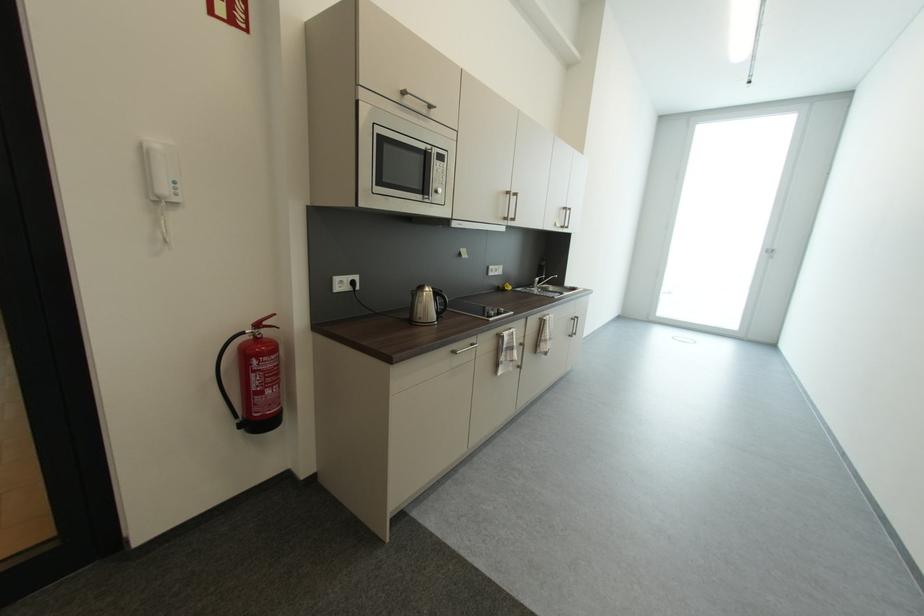
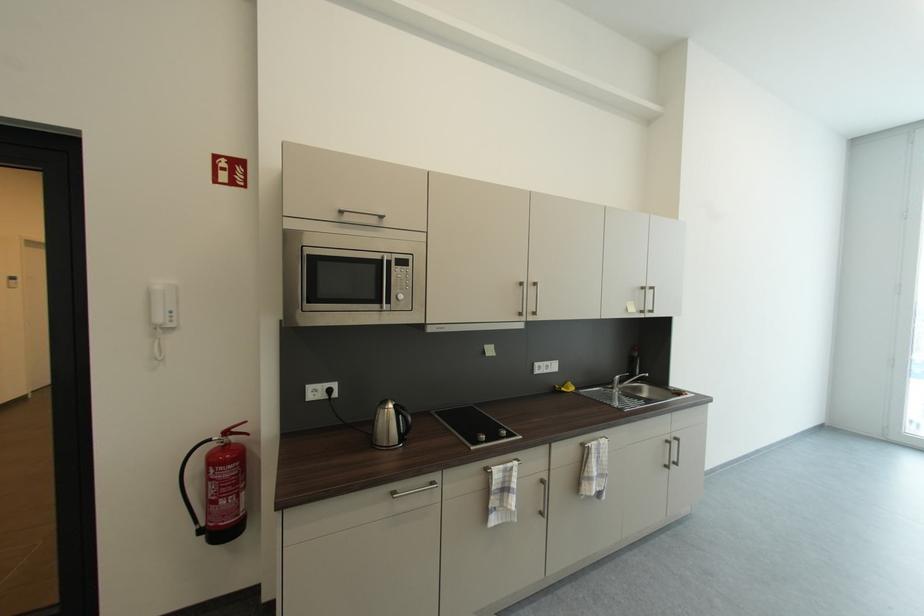
In the second image, find the point that corresponds to (x=513, y=290) in the first image.

(569, 391)